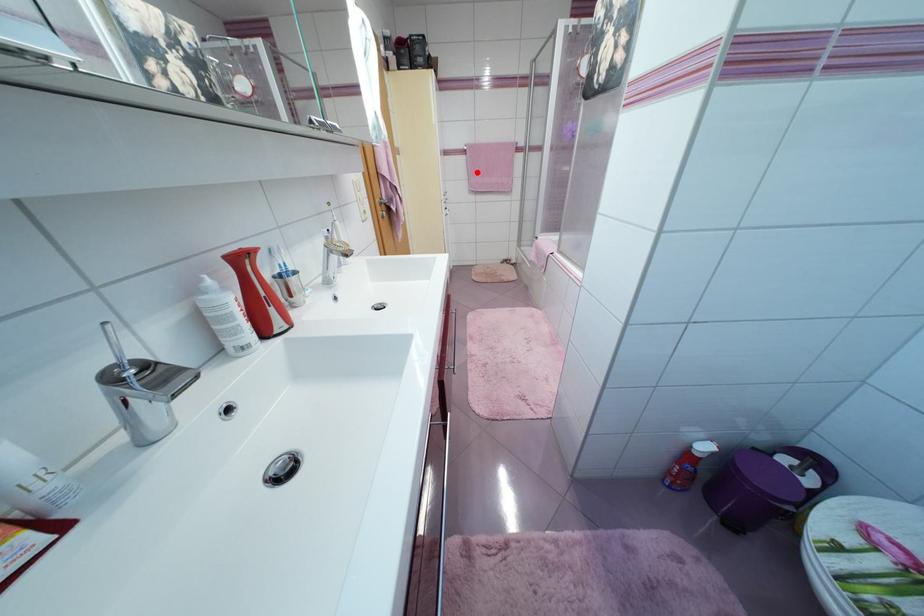
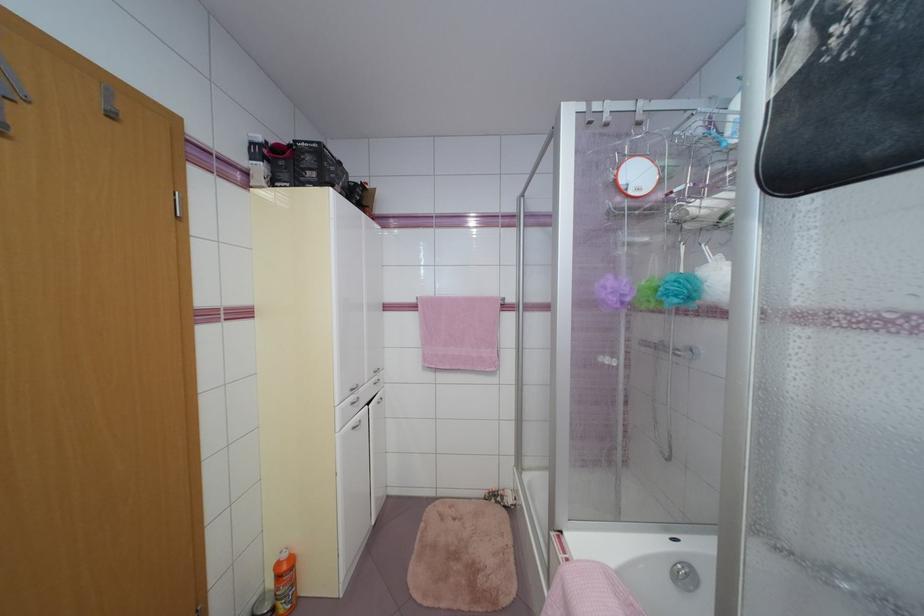
Question: I am providing you with two images of the same scene from different viewpoints. Image1 has a red point marked. In image2, the corresponding 3D location appears at what relative position? Reply with the corresponding letter.

Choices:
 (A) Closer
 (B) Farther

Answer: (B)